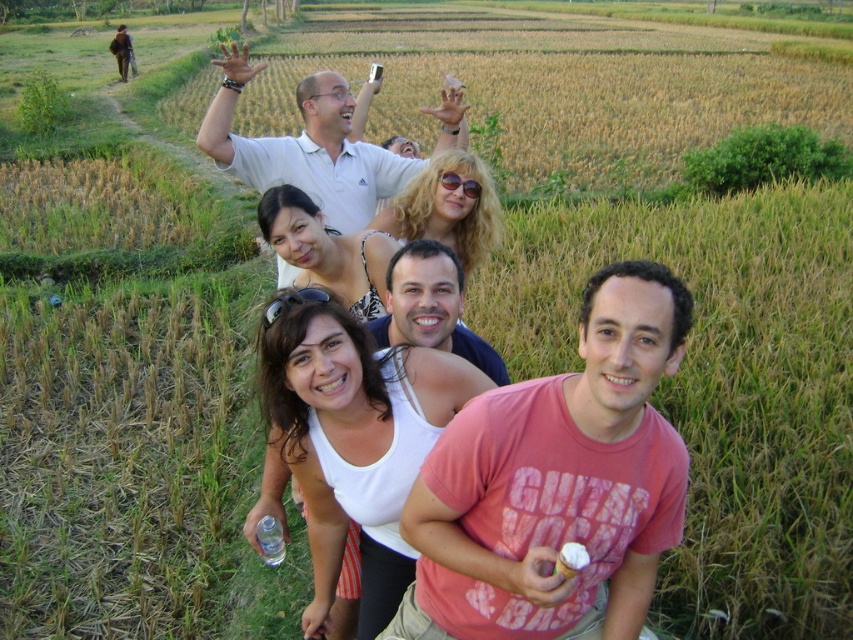
Which is in front, point (456, 410) or point (252, 170)?

Point (456, 410) is in front.

Who is more forward, (363, 547) or (329, 100)?

Point (363, 547) is more forward.

You are a GUI agent. You are given a task and a screenshot of the screen. Output one action in this format:
    pyautogui.click(x=<x>, y=<y>)
    Task: Click on the white cotton shirt at center
    
    Given the screenshot: What is the action you would take?
    pyautogui.click(x=425, y=337)

Which is more to the right, pink cotton t-shirt at center or white matte shirt at upper center?

pink cotton t-shirt at center is more to the right.

Which is in front, point (509, 458) or point (432, 154)?

Point (509, 458) is in front.

Who is more distant from viewer, (456, 596) or (196, 132)?

Positioned behind is point (196, 132).

Image resolution: width=853 pixels, height=640 pixels. In order to click on pink cotton t-shirt at center in this screenshot , I will do `click(556, 481)`.

How distant is pink cotton t-shirt at center from white cotton shirt at center?

pink cotton t-shirt at center and white cotton shirt at center are 20.73 inches apart from each other.

Is pink cotton t-shirt at center to the left of white cotton shirt at center from the viewer's perspective?

No, pink cotton t-shirt at center is not to the left of white cotton shirt at center.

This screenshot has width=853, height=640. Identify the location of pink cotton t-shirt at center. (556, 481).